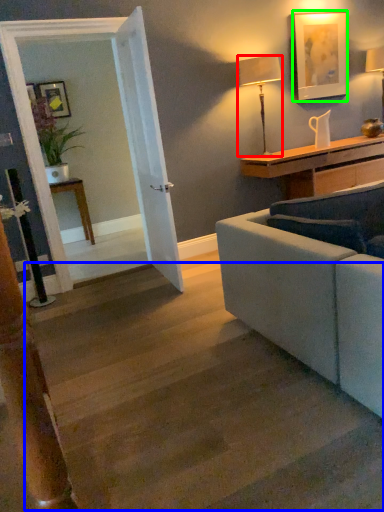
Question: Which object is positioned closest to lamp (highlighted by a red box)? Select from stairwell (highlighted by a blue box) and picture frame (highlighted by a green box).

Choices:
 (A) stairwell
 (B) picture frame

Answer: (B)